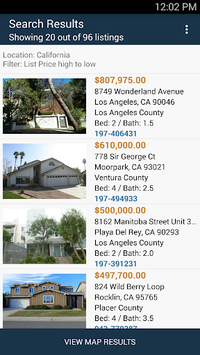
This screenshot has width=200, height=355. Find the location of `front door`. front door is located at coordinates (73, 300), (34, 180), (63, 120), (58, 252).